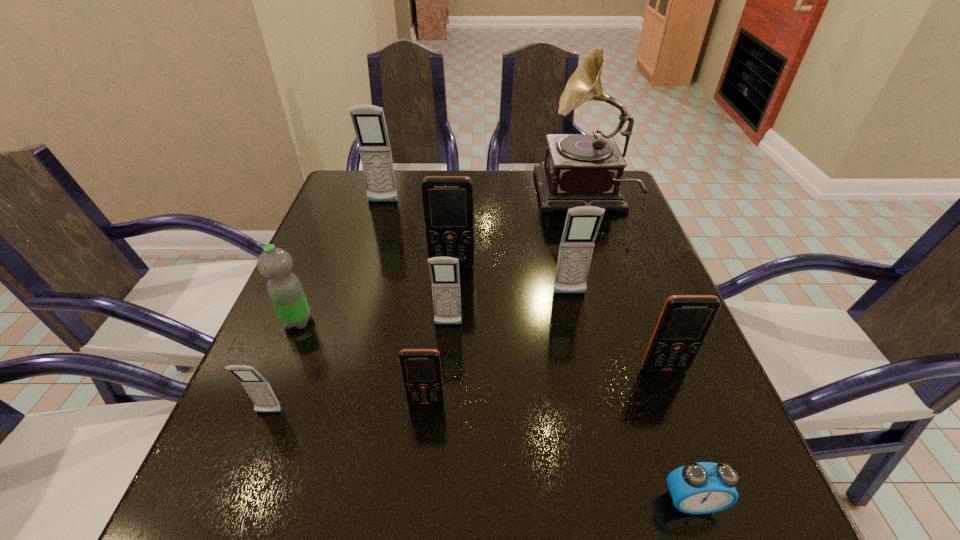
In the image, there is a desktop. Where is `vacant space at the far edge`? The height and width of the screenshot is (540, 960). vacant space at the far edge is located at coordinates (522, 198).

Where is `vacant space at the near edge of the desktop`? vacant space at the near edge of the desktop is located at coordinates click(546, 511).

The width and height of the screenshot is (960, 540). Find the location of `blank space at the left edge of the desktop`. blank space at the left edge of the desktop is located at coordinates (303, 423).

This screenshot has height=540, width=960. Find the location of `free location at the right edge of the desktop`. free location at the right edge of the desktop is located at coordinates (698, 423).

In the image, there is a desktop. What are the coordinates of `vacant space at the far left corner` in the screenshot? It's located at (355, 185).

Find the location of a particular element. The image size is (960, 540). vacant area between the leftmost cellular telephone and the nearest object is located at coordinates (480, 457).

At what (x,y) coordinates should I click in order to perform the action: click on free space between the biggest orange cellular telephone and the record player. Please return your answer as a coordinate pair (x, y). The height and width of the screenshot is (540, 960). Looking at the image, I should click on coord(516,231).

Locate an element on the screen. The height and width of the screenshot is (540, 960). vacant point located between the third farthest object and the second biggest gray cellular telephone is located at coordinates (511, 280).

Find the location of `empty space between the second smallest gray cellular telephone and the second biggest gray cellular telephone`. empty space between the second smallest gray cellular telephone and the second biggest gray cellular telephone is located at coordinates (509, 309).

Where is `free space between the second nearest gray cellular telephone and the leftmost cellular telephone`? free space between the second nearest gray cellular telephone and the leftmost cellular telephone is located at coordinates (358, 369).